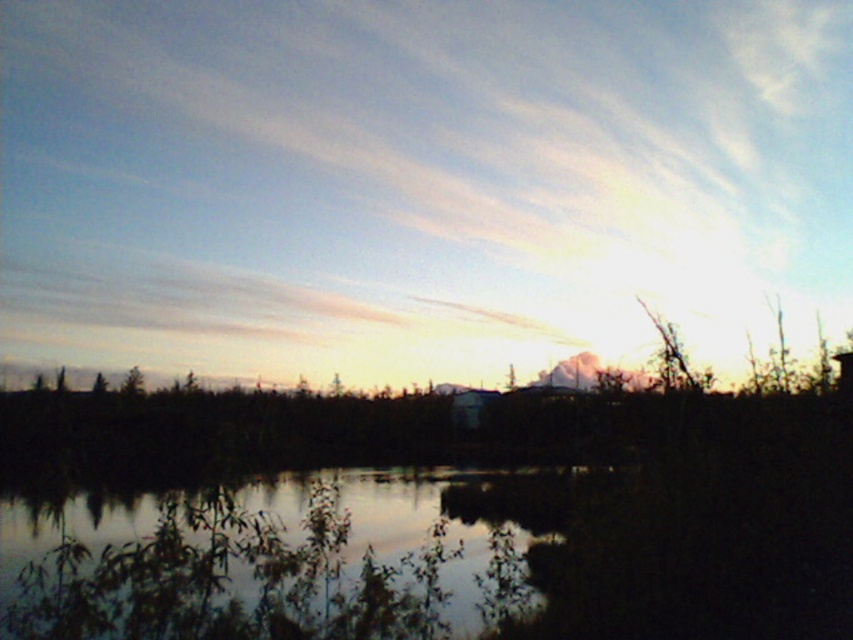
Question: Among these points, which one is farthest from the camera?

Choices:
 (A) (160, 550)
 (B) (80, 20)

Answer: (B)

Question: Does white fluffy cloud at upper center appear over silvery reflective water at center?

Choices:
 (A) no
 (B) yes

Answer: (B)

Question: Does white fluffy cloud at upper center appear under silvery reflective water at center?

Choices:
 (A) yes
 (B) no

Answer: (B)

Question: Does white fluffy cloud at upper center have a greater width compared to silvery reflective water at center?

Choices:
 (A) yes
 (B) no

Answer: (A)

Question: Which object appears farthest from the camera in this image?

Choices:
 (A) white fluffy cloud at upper center
 (B) silvery reflective water at center

Answer: (A)